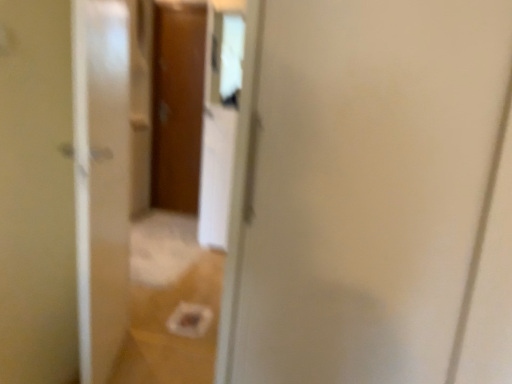
Where is `wooden door at center`? Image resolution: width=512 pixels, height=384 pixels. wooden door at center is located at coordinates click(x=177, y=104).

Describe the element at coordinates (101, 180) in the screenshot. I see `transparent glass screen door at left` at that location.

Where is `transparent glass door at center`? The image size is (512, 384). transparent glass door at center is located at coordinates (109, 167).

Between transparent glass screen door at left and wooden door at center, which one has larger width?

Wider between the two is transparent glass screen door at left.

Is transparent glass screen door at left not within wooden door at center?

Yes.

Is transparent glass screen door at left placed right next to wooden door at center?

transparent glass screen door at left is not next to wooden door at center, and they're not touching.

Looking at this image, relative to wooden door at center, is transparent glass screen door at left in front or behind?

Clearly, transparent glass screen door at left is in front of wooden door at center.

Which of these two, transparent glass screen door at left or transparent glass door at center, is wider?

transparent glass screen door at left is wider.

In terms of size, does transparent glass screen door at left appear bigger or smaller than transparent glass door at center?

transparent glass screen door at left is bigger than transparent glass door at center.

Which of these two, transparent glass screen door at left or transparent glass door at center, stands taller?

transparent glass door at center is taller.

From a real-world perspective, is transparent glass screen door at left physically above transparent glass door at center?

No, from a real-world perspective, transparent glass screen door at left is not over transparent glass door at center

Which object is further away from the camera taking this photo, transparent glass door at center or transparent glass screen door at left?

transparent glass door at center is behind.

Is transparent glass door at center placed right next to transparent glass screen door at left?

Yes, transparent glass door at center is beside transparent glass screen door at left.

From the image's perspective, between wooden door at center and transparent glass door at center, which one is located above?

wooden door at center, from the image's perspective.

How many degrees apart are the facing directions of wooden door at center and transparent glass door at center?

There is a 0.727-degree angle between the facing directions of wooden door at center and transparent glass door at center.

Consider the image. Measure the distance between wooden door at center and transparent glass door at center.

wooden door at center is 2.35 meters from transparent glass door at center.

Are wooden door at center and transparent glass door at center far apart?

Yes.

Looking at this image, is transparent glass door at center inside the boundaries of wooden door at center, or outside?

transparent glass door at center is not enclosed by wooden door at center.

Does transparent glass door at center have a lesser width compared to wooden door at center?

Yes, transparent glass door at center is thinner than wooden door at center.

From a real-world perspective, is transparent glass door at center physically located above or below wooden door at center?

transparent glass door at center is below wooden door at center.

Does transparent glass door at center turn towards wooden door at center?

No, transparent glass door at center is not turned towards wooden door at center.

Considering the sizes of objects wooden door at center and transparent glass screen door at left in the image provided, who is taller, wooden door at center or transparent glass screen door at left?

wooden door at center.

Is wooden door at center positioned far away from transparent glass screen door at left?

Yes, wooden door at center and transparent glass screen door at left are quite far apart.

Considering the sizes of objects wooden door at center and transparent glass screen door at left in the image provided, who is smaller, wooden door at center or transparent glass screen door at left?

Smaller between the two is wooden door at center.

Find the location of a particular element. The image size is (512, 384). screen door on the right of wooden door at center is located at coordinates (101, 180).

Image resolution: width=512 pixels, height=384 pixels. I want to click on door on the left of transparent glass screen door at left, so click(177, 104).

Image resolution: width=512 pixels, height=384 pixels. In order to click on screen door below the transparent glass door at center (from the image's perspective) in this screenshot , I will do `click(101, 180)`.

Based on their spatial positions, is wooden door at center or transparent glass screen door at left further from transparent glass door at center?

wooden door at center.

Considering their positions, is transparent glass screen door at left positioned closer to wooden door at center than transparent glass door at center?

Based on the image, transparent glass door at center appears to be nearer to wooden door at center.

Looking at the image, which one is located further to wooden door at center, transparent glass door at center or transparent glass screen door at left?

transparent glass screen door at left is positioned further to the anchor wooden door at center.

When comparing their distances from transparent glass door at center, does transparent glass screen door at left or wooden door at center seem closer?

transparent glass screen door at left.

Which object lies nearer to the anchor point transparent glass screen door at left, wooden door at center or transparent glass door at center?

transparent glass door at center is closer to transparent glass screen door at left.

Based on the photo, which object lies further to the anchor point transparent glass screen door at left, transparent glass door at center or wooden door at center?

wooden door at center is positioned further to the anchor transparent glass screen door at left.

The image size is (512, 384). Identify the location of glass door positioned between transparent glass screen door at left and wooden door at center from near to far. (109, 167).